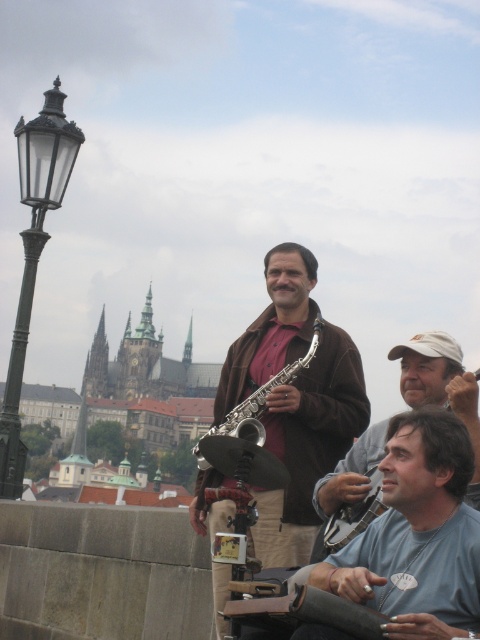
Question: Can you confirm if black glass lamp post at left is smaller than metallic silver saxophone at center?

Choices:
 (A) yes
 (B) no

Answer: (B)

Question: Is gray fabric shirt at center in front of silver metallic saxophone at center?

Choices:
 (A) yes
 (B) no

Answer: (A)

Question: Which object is positioned closest to the metallic silver saxophone at center?

Choices:
 (A) black glass lamp post at left
 (B) silver metallic saxophone at center
 (C) brown suede jacket at center
 (D) matte brown saxophone at center

Answer: (D)

Question: Is brown suede jacket at center to the right of metallic silver saxophone at center from the viewer's perspective?

Choices:
 (A) yes
 (B) no

Answer: (B)

Question: Which object appears farthest from the camera in this image?

Choices:
 (A) black glass lamp post at left
 (B) silver metallic saxophone at center
 (C) metallic silver saxophone at center

Answer: (B)

Question: Which object is the farthest from the gray fabric shirt at center?

Choices:
 (A) black glass lamp post at left
 (B) metallic silver saxophone at center

Answer: (A)